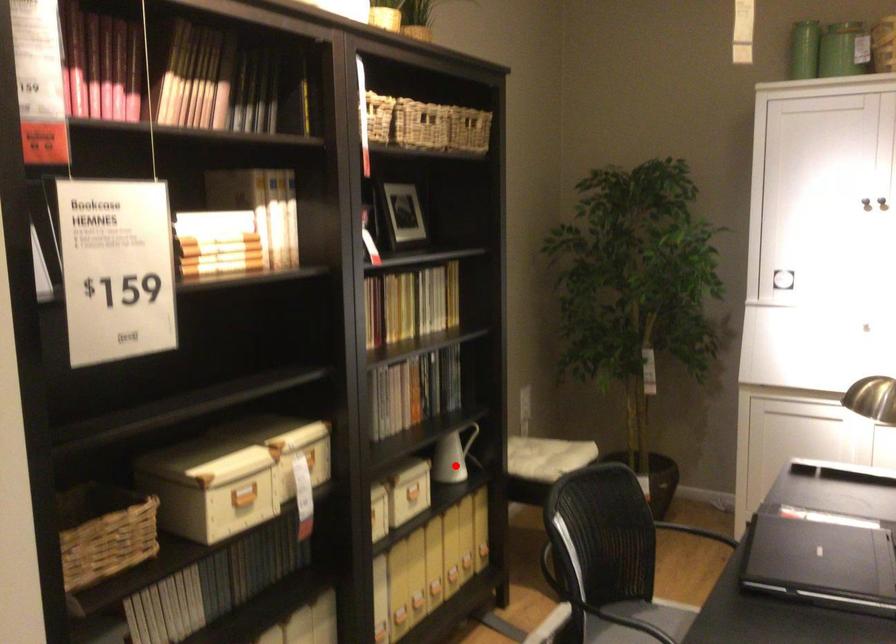
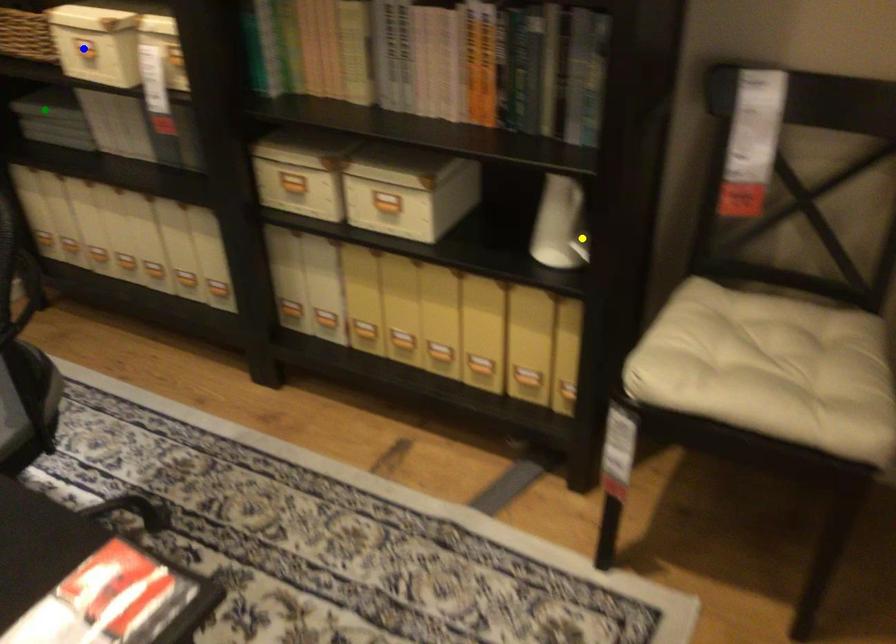
Question: I am providing you with two images of the same scene from different viewpoints. A red point is marked on the first image. You are given multiple points on the second image. Can you choose the point in image 2 that corresponds to the point in image 1?

Choices:
 (A) yellow point
 (B) blue point
 (C) green point

Answer: (A)